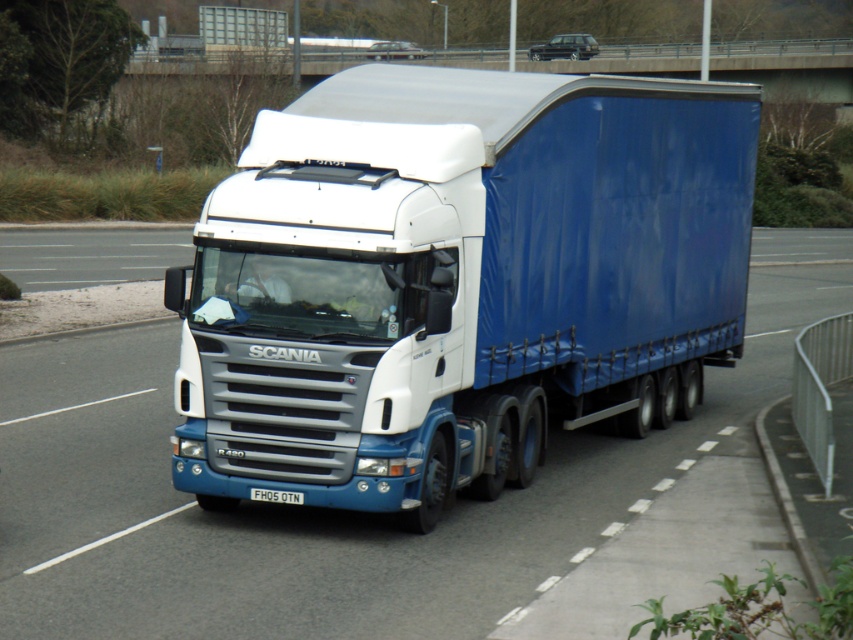
You are a truck driver planning to park the blue fabric truck at center in a parking spot that is exactly the same width as the white plastic license plate at center. Will the truck fit into the parking spot?

The blue fabric truck at center is wider than the white plastic license plate at center, so it will not fit into the parking spot.

You are a truck driver who needs to check the license plate for a toll booth ahead. Can you see the white plastic license plate at center from your current position inside the blue fabric truck at center?

The blue fabric truck at center is positioned over the white plastic license plate at center, so the license plate is likely obstructed and not visible from inside the truck.